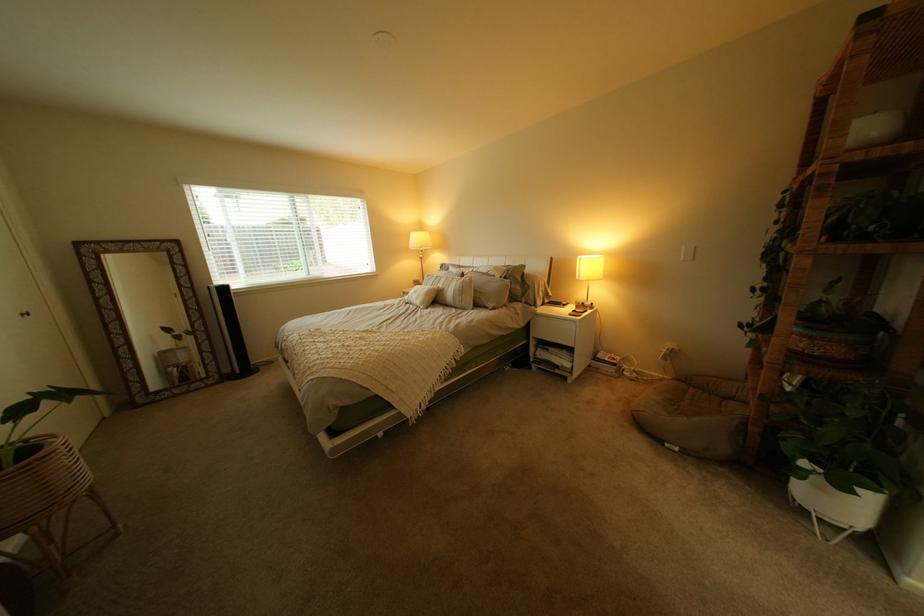
Where would you turn the rotary lamp switch? Please return your answer as a coordinate pair (x, y).

(667, 350)